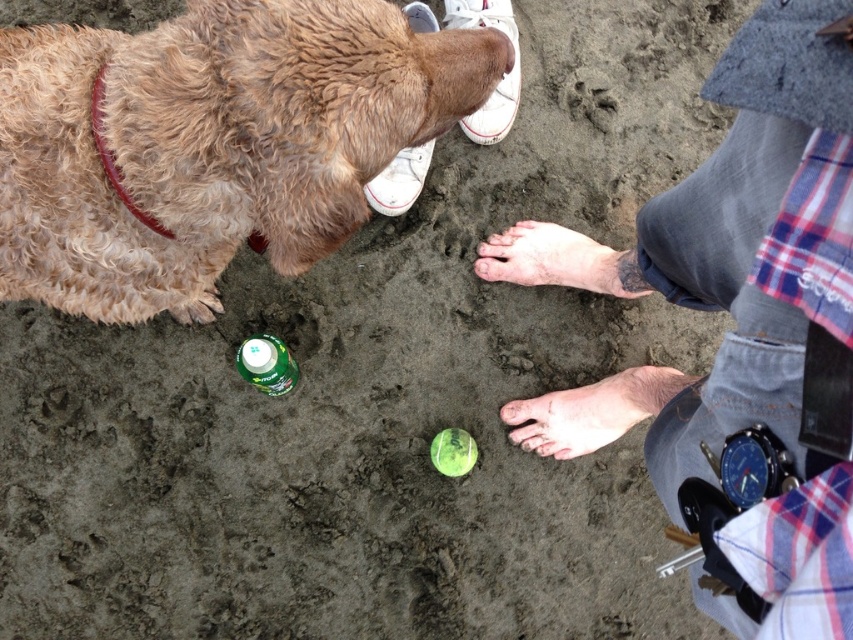
Which of these two, curly fur dog at upper left or white canvas shoe at upper center, stands taller?

Standing taller between the two is curly fur dog at upper left.

Does curly fur dog at upper left have a lesser height compared to white canvas shoe at upper center?

No.

Find the location of a particular element. curly fur dog at upper left is located at coordinates (210, 141).

I want to click on curly fur dog at upper left, so click(210, 141).

Looking at this image, can you confirm if white canvas shoe at upper center is positioned to the right of green plastic bottle at center?

Indeed, white canvas shoe at upper center is positioned on the right side of green plastic bottle at center.

How far apart are white canvas shoe at upper center and green plastic bottle at center?

The distance of white canvas shoe at upper center from green plastic bottle at center is 25.29 inches.

Between point (465, 8) and point (282, 349), which one is positioned in front?

Positioned in front is point (282, 349).

Locate an element on the screen. Image resolution: width=853 pixels, height=640 pixels. white canvas shoe at upper center is located at coordinates (502, 76).

Is denim shorts at lower right behind brown leather collar at upper left?

No, it is not.

Who is shorter, denim shorts at lower right or brown leather collar at upper left?

With less height is brown leather collar at upper left.

Is point (813, 257) farther from viewer compared to point (115, 189)?

No, it is in front of (115, 189).

Locate an element on the screen. denim shorts at lower right is located at coordinates (735, 256).